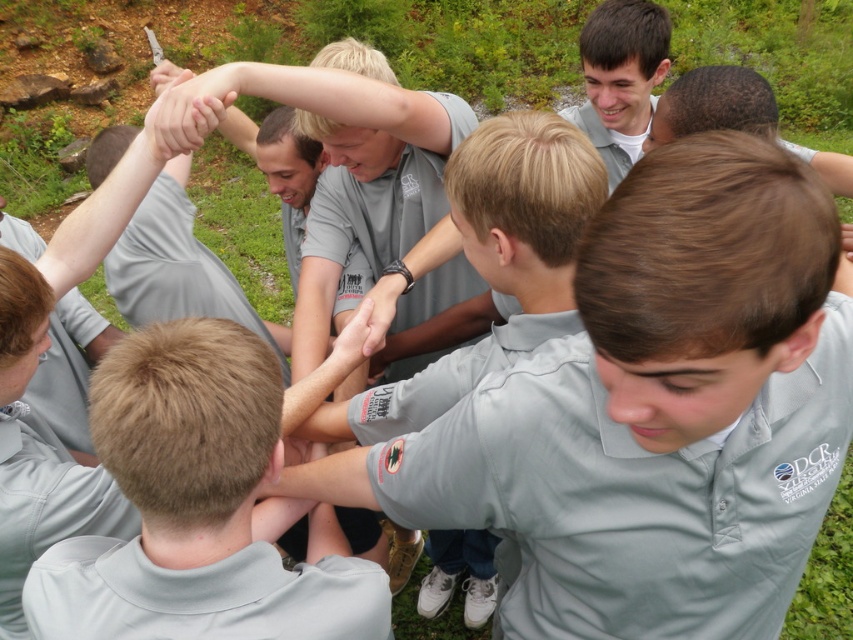
How distant is matte gray shirt at center from light brown hair at center?

matte gray shirt at center is 13.49 inches away from light brown hair at center.

Who is lower down, matte gray shirt at center or light brown hair at center?

light brown hair at center

This screenshot has height=640, width=853. I want to click on matte gray shirt at center, so click(x=653, y=412).

I want to click on matte gray shirt at center, so click(653, 412).

Is point (759, 310) positioned behind point (190, 106)?

No, (759, 310) is closer to viewer.

Is matte gray shirt at center to the left of matte gray hand at center from the viewer's perspective?

Incorrect, matte gray shirt at center is not on the left side of matte gray hand at center.

Measure the distance between point (659, 532) and camera.

The distance of point (659, 532) from camera is 3.69 feet.

What are the coordinates of `matte gray shirt at center` in the screenshot? It's located at (653, 412).

Does light brown hair at center appear over matte gray hand at center?

No, light brown hair at center is not above matte gray hand at center.

Find the location of a particular element. The image size is (853, 640). light brown hair at center is located at coordinates (198, 508).

Locate an element on the screen. The width and height of the screenshot is (853, 640). light brown hair at center is located at coordinates (198, 508).